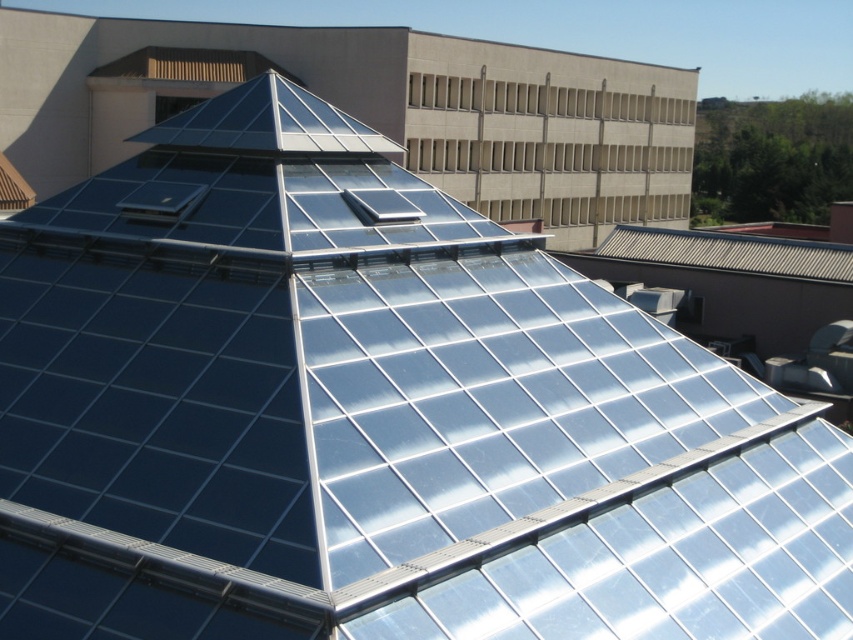
Question: Can you confirm if black glossy solar battery at upper left is wider than transparent glass solar battery at center?

Choices:
 (A) no
 (B) yes

Answer: (B)

Question: Can you confirm if black glossy solar battery at upper left is positioned to the left of transparent glass solar battery at center?

Choices:
 (A) no
 (B) yes

Answer: (B)

Question: Among these points, which one is farthest from the camera?

Choices:
 (A) (363, 202)
 (B) (190, 189)

Answer: (B)

Question: Observing the image, what is the correct spatial positioning of black glossy solar battery at upper left in reference to transparent glass solar battery at center?

Choices:
 (A) left
 (B) right

Answer: (A)

Question: Which point appears closest to the camera in this image?

Choices:
 (A) click(138, 189)
 (B) click(405, 204)

Answer: (A)